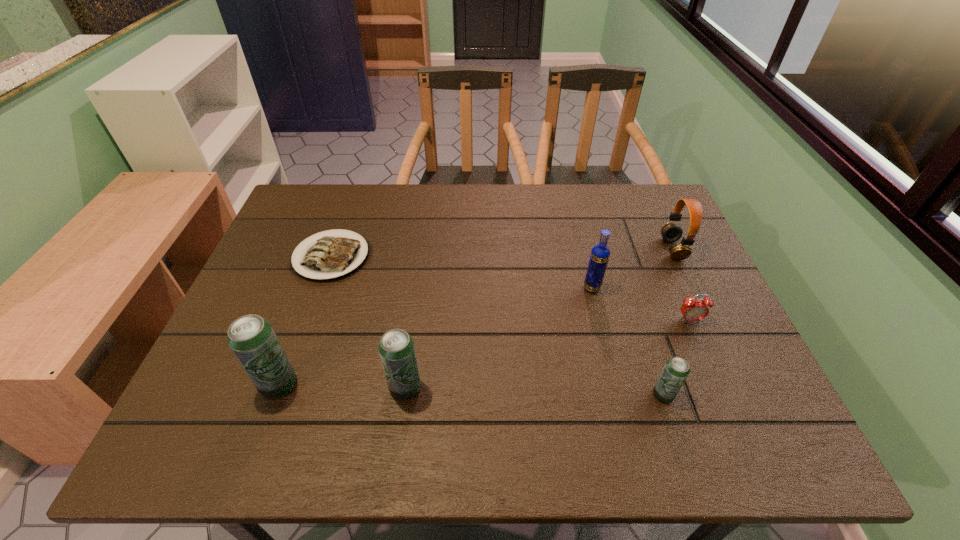
Where is `free space between the second beer can from right to left and the sixth tallest object`? This screenshot has height=540, width=960. free space between the second beer can from right to left and the sixth tallest object is located at coordinates (547, 354).

Find the location of a particular element. empty space that is in between the fourth object from right to left and the shortest object is located at coordinates (462, 272).

Locate which object is the closest to the leftmost beer can. Please provide its 2D coordinates. Your answer should be formatted as a tuple, i.e. [(x, y)], where the tuple contains the x and y coordinates of a point satisfying the conditions above.

[(396, 348)]

Identify which object is the third nearest to the headset. Please provide its 2D coordinates. Your answer should be formatted as a tuple, i.e. [(x, y)], where the tuple contains the x and y coordinates of a point satisfying the conditions above.

[(676, 369)]

Identify the location of beer can that is the closest to the fourth farthest object. (676, 369).

Where is `beer can that is the closest to the second tallest beer can`? Image resolution: width=960 pixels, height=540 pixels. beer can that is the closest to the second tallest beer can is located at coordinates (251, 338).

The width and height of the screenshot is (960, 540). What are the coordinates of `free location that satisfies the following two spatial constraints: 1. on the front side of the shortest object; 2. on the right side of the rightmost beer can` in the screenshot? It's located at (283, 395).

Identify the location of vacant space that satisfies the following two spatial constraints: 1. on the ear cups of the headset; 2. on the front side of the third object from left to right. pyautogui.click(x=737, y=388).